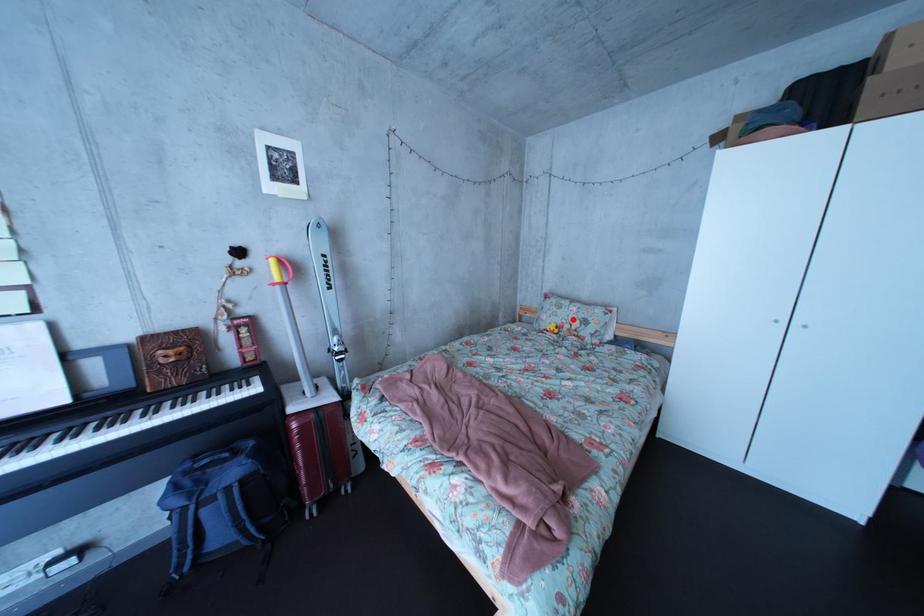
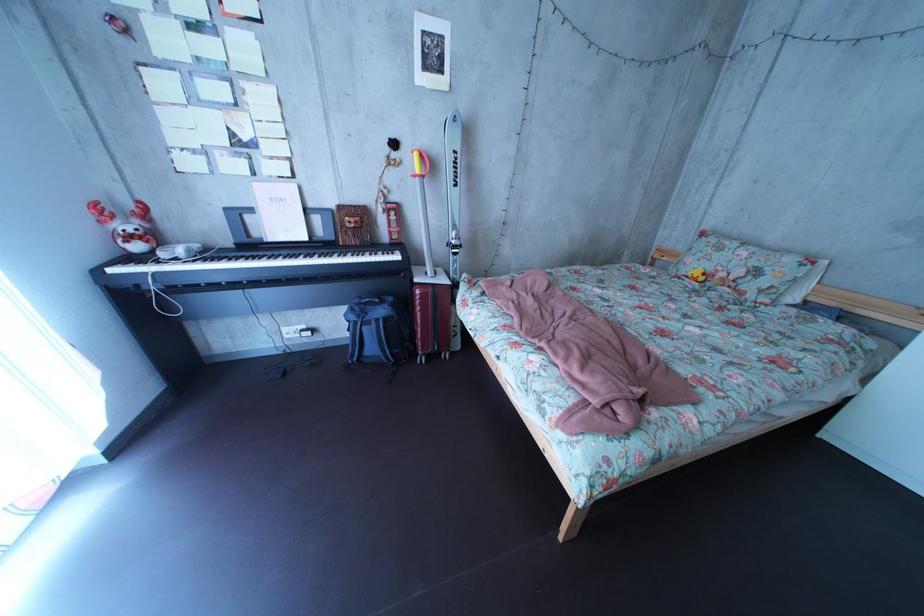
The point at the highlighted location is marked in the first image. Where is the corresponding point in the second image?

(731, 262)